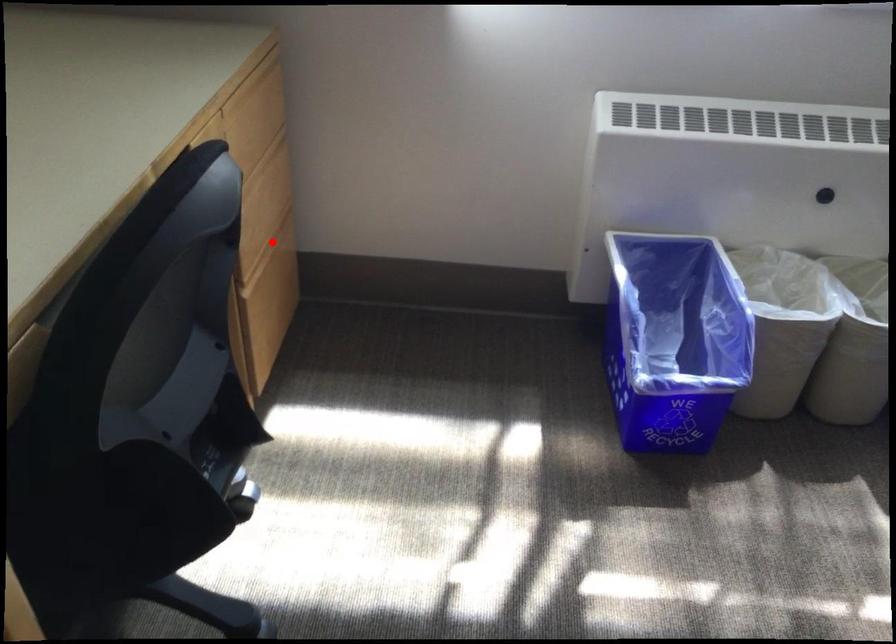
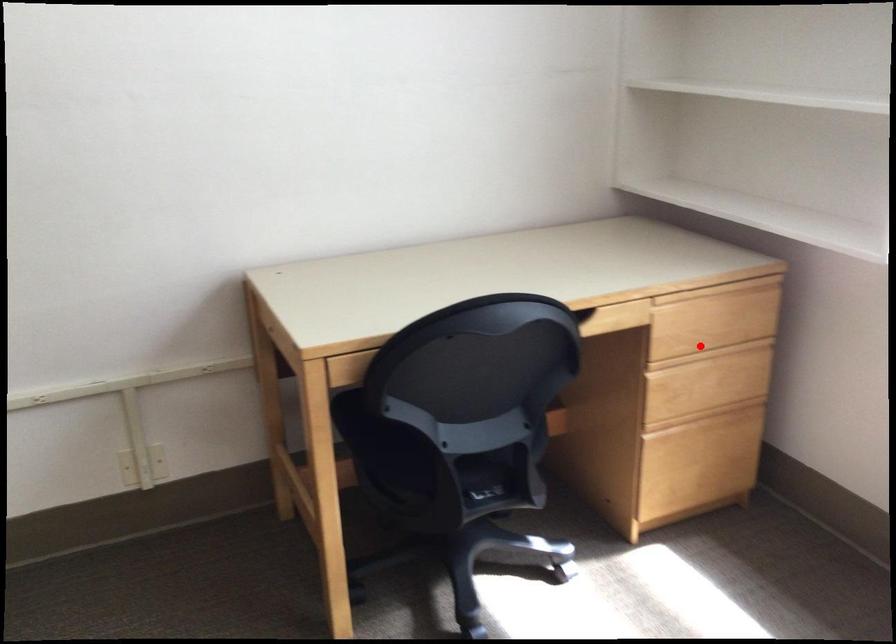
I am providing you with two images of the same scene from different viewpoints. A red point is marked on the first image and another point is marked on the second image. Are the points marked in image1 and image2 representing the same 3D position?

No